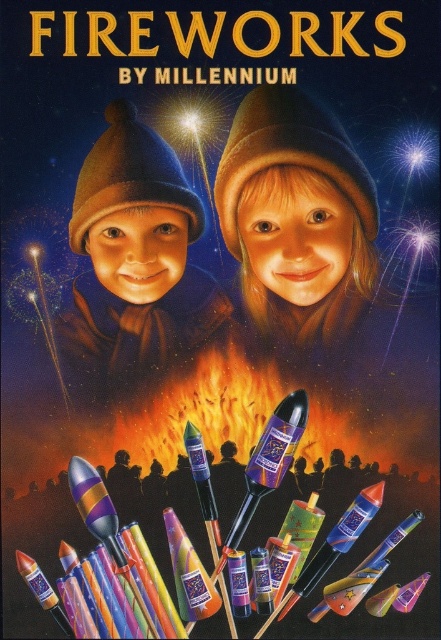
Question: Among these points, which one is nearest to the camera?

Choices:
 (A) (176, 273)
 (B) (358, 157)

Answer: (B)

Question: Does smooth brown hat at center have a greater width compared to matte brown hat at center?

Choices:
 (A) yes
 (B) no

Answer: (B)

Question: Is smooth brown hat at center smaller than matte brown hat at center?

Choices:
 (A) yes
 (B) no

Answer: (A)

Question: Is smooth brown hat at center positioned in front of matte brown hat at center?

Choices:
 (A) yes
 (B) no

Answer: (A)

Question: Among these objects, which one is farthest from the camera?

Choices:
 (A) smooth brown hat at center
 (B) matte brown hat at center

Answer: (B)